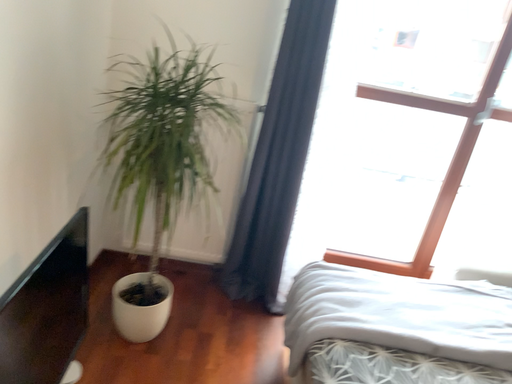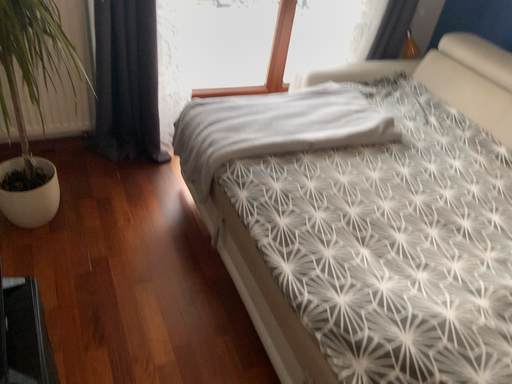
Question: Which way did the camera rotate in the video?

Choices:
 (A) rotated left
 (B) rotated right

Answer: (B)